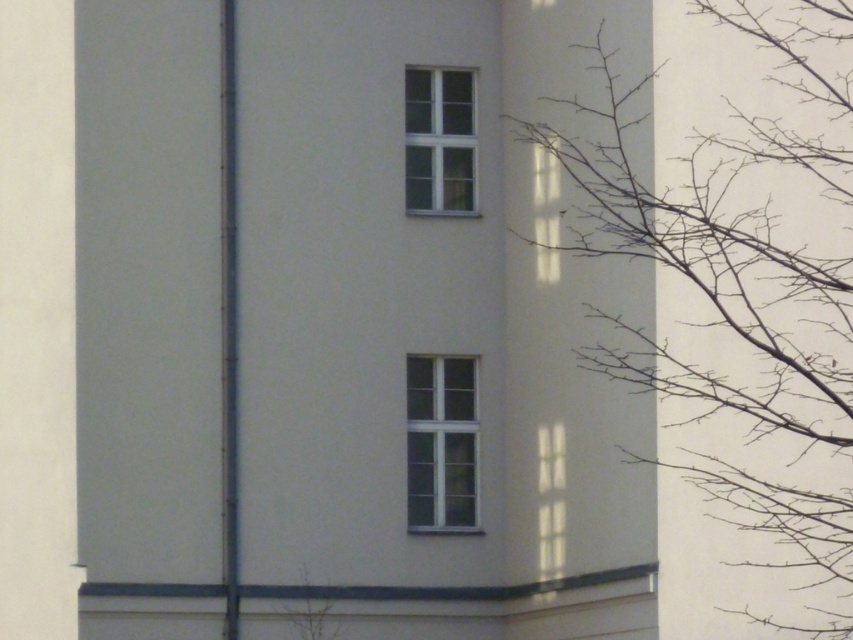
Does point (589, 10) lie behind point (733, 285)?

Yes, point (589, 10) is farther from viewer.

Can you confirm if white smooth wall at center is wider than bare branches at right?

Correct, the width of white smooth wall at center exceeds that of bare branches at right.

Where is `white smooth wall at center`? This screenshot has width=853, height=640. white smooth wall at center is located at coordinates (340, 330).

Which is above, white smooth wall at center or clear glass window at center?

white smooth wall at center is higher up.

Where is `white smooth wall at center`? Image resolution: width=853 pixels, height=640 pixels. white smooth wall at center is located at coordinates 340,330.

Find the location of a particular element. white smooth wall at center is located at coordinates (340, 330).

Does bare branches at right appear on the right side of clear glass window at center?

Indeed, bare branches at right is positioned on the right side of clear glass window at center.

Which is more to the left, bare branches at right or clear glass window at center?

clear glass window at center

Which is behind, point (738, 221) or point (426, 488)?

The point (426, 488) is behind.

Identify the location of bare branches at right. (741, 284).